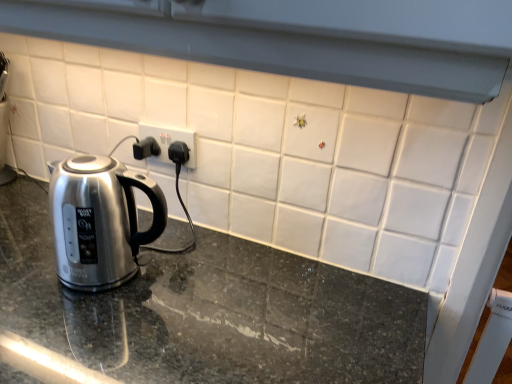
Where is `vacant area that lies to the right of satin metallic kettle at left`? vacant area that lies to the right of satin metallic kettle at left is located at coordinates (195, 293).